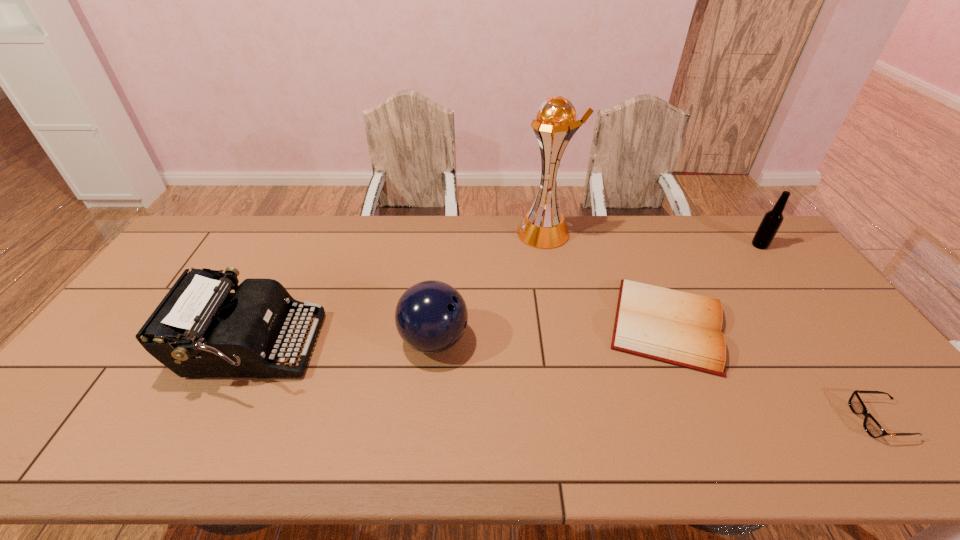
Locate an element on the screen. This screenshot has width=960, height=540. vacant area in the image that satisfies the following two spatial constraints: 1. on the front-facing side of the beer bottle; 2. on the right side of the tallest object is located at coordinates (547, 245).

The image size is (960, 540). What are the coordinates of `free space that satisfies the following two spatial constraints: 1. on the front-facing side of the fourth object from left to right; 2. on the left side of the tallest object` in the screenshot? It's located at (562, 325).

Where is `free location that satisfies the following two spatial constraints: 1. on the front-facing side of the tallest object; 2. on the left side of the Bible`? This screenshot has height=540, width=960. free location that satisfies the following two spatial constraints: 1. on the front-facing side of the tallest object; 2. on the left side of the Bible is located at coordinates (562, 325).